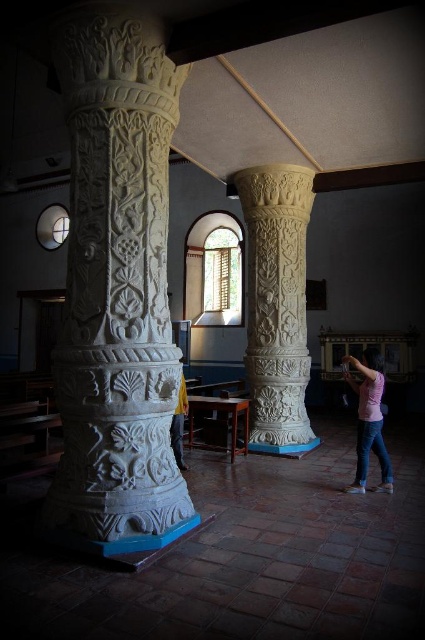
Which of these two, white stone column at left or yellow fabric at center, stands taller?

white stone column at left

Who is shorter, white stone column at left or yellow fabric at center?

yellow fabric at center is shorter.

Is point (139, 432) farther from viewer compared to point (183, 385)?

That is False.

Locate an element on the screen. The height and width of the screenshot is (640, 425). white stone column at left is located at coordinates (116, 291).

This screenshot has height=640, width=425. What do you see at coordinates (116, 291) in the screenshot?
I see `white stone column at left` at bounding box center [116, 291].

Does point (84, 28) lie in front of point (362, 356)?

Yes, it is in front of point (362, 356).

Is point (79, 289) positioned before point (346, 376)?

Yes.

Identify the location of white stone column at left. The height and width of the screenshot is (640, 425). (116, 291).

Does white stone column at left have a greater width compared to white carved column at center?

Correct, the width of white stone column at left exceeds that of white carved column at center.

Is white stone column at left shorter than white carved column at center?

Incorrect, white stone column at left's height does not fall short of white carved column at center's.

Is point (78, 234) farther from camera compared to point (300, 218)?

No.

What are the coordinates of `white stone column at left` in the screenshot? It's located at (116, 291).